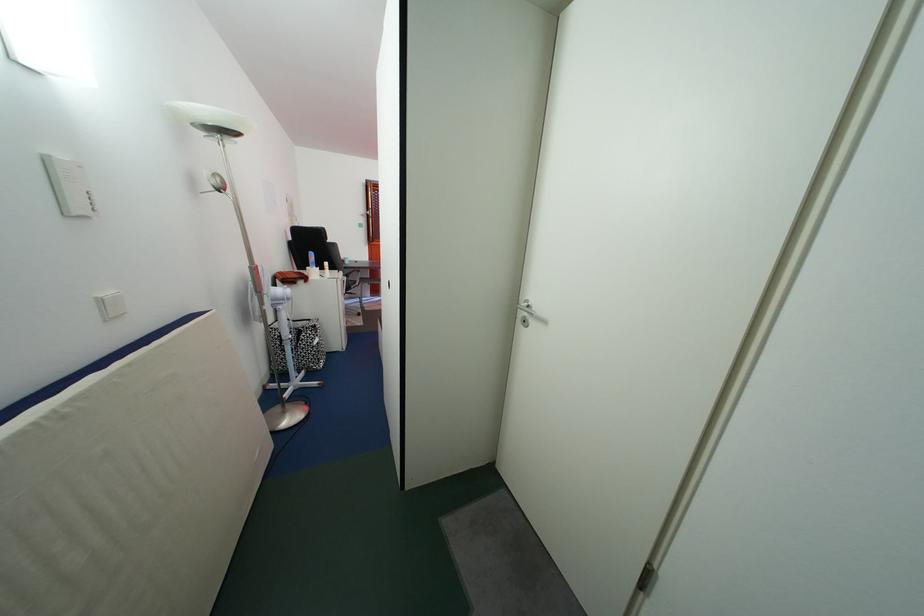
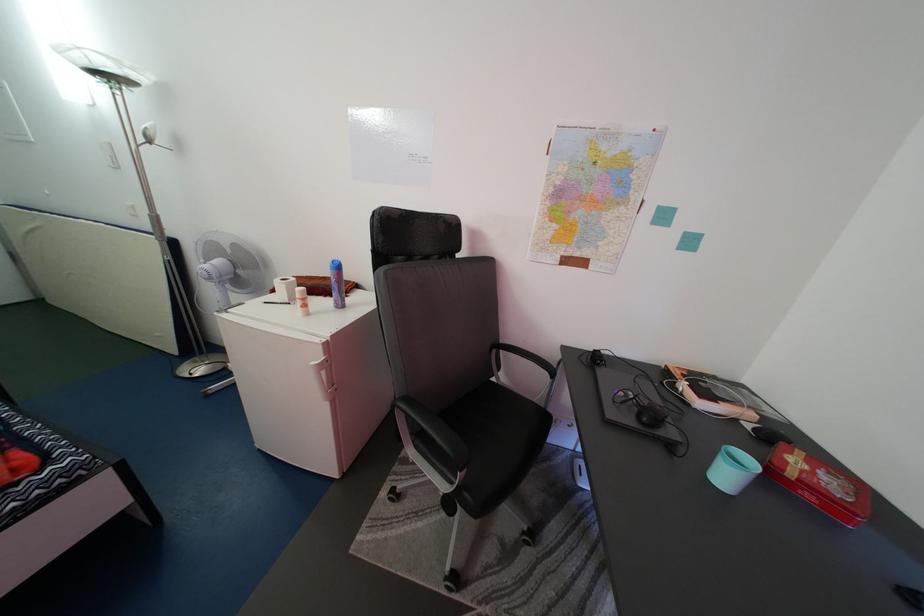
Where in the second image is the point corresponding to point 356,269 from the first image?

(735, 484)